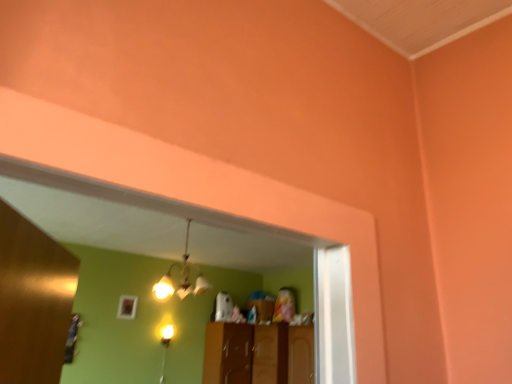
Describe the element at coordinates (228, 353) in the screenshot. Image resolution: width=512 pixels, height=384 pixels. I see `brown wood cabinet at center` at that location.

What is the approximate width of brown wood cabinet at center?

brown wood cabinet at center is 52.88 centimeters in width.

Locate an element on the screen. The height and width of the screenshot is (384, 512). brown wood cabinet at center is located at coordinates (228, 353).

What is the approximate width of matte brass chandelier at center?

matte brass chandelier at center is 19.59 inches wide.

In order to face matte brass chandelier at center, should I rotate leftwards or rightwards?

You should look left and rotate roughly 8.599 degrees.

Identify the location of matte brass chandelier at center. The image size is (512, 384). (181, 278).

Describe the element at coordinates (181, 278) in the screenshot. I see `matte brass chandelier at center` at that location.

Find the location of a particular element. brown wood cabinet at center is located at coordinates (228, 353).

Would you say brown wood cabinet at center is to the left or to the right of matte brass chandelier at center in the picture?

In the image, brown wood cabinet at center appears on the right side of matte brass chandelier at center.

In the image, is brown wood cabinet at center positioned in front of or behind matte brass chandelier at center?

Clearly, brown wood cabinet at center is behind matte brass chandelier at center.

Between point (244, 383) and point (198, 280), which one is positioned in front?

Positioned in front is point (198, 280).

From the image's perspective, who appears lower, brown wood cabinet at center or matte brass chandelier at center?

brown wood cabinet at center.

From a real-world perspective, relative to matte brass chandelier at center, is brown wood cabinet at center vertically above or below?

Clearly, from a real-world perspective, brown wood cabinet at center is below matte brass chandelier at center.

Considering the sizes of brown wood cabinet at center and matte brass chandelier at center in the image, is brown wood cabinet at center wider or thinner than matte brass chandelier at center?

Considering their sizes, brown wood cabinet at center looks broader than matte brass chandelier at center.

Can you confirm if brown wood cabinet at center is taller than matte brass chandelier at center?

Correct, brown wood cabinet at center is much taller as matte brass chandelier at center.

Does brown wood cabinet at center have a smaller size compared to matte brass chandelier at center?

Incorrect, brown wood cabinet at center is not smaller in size than matte brass chandelier at center.

Choose the correct answer: Is brown wood cabinet at center inside matte brass chandelier at center or outside it?

The correct answer is: outside.

Is brown wood cabinet at center far away from matte brass chandelier at center?

Indeed, brown wood cabinet at center is not near matte brass chandelier at center.

Is brown wood cabinet at center oriented away from matte brass chandelier at center?

No, matte brass chandelier at center is not at the back of brown wood cabinet at center.

Find the location of a particular element. light fixture above the brown wood cabinet at center (from a real-world perspective) is located at coordinates (181, 278).

Is matte brass chandelier at center to the left of brown wood cabinet at center from the viewer's perspective?

Yes, matte brass chandelier at center is to the left of brown wood cabinet at center.

Does matte brass chandelier at center come in front of brown wood cabinet at center?

Yes, it is.

Is point (161, 292) closer or farther from the camera than point (224, 355)?

Point (161, 292).

From the image's perspective, is matte brass chandelier at center under brown wood cabinet at center?

Actually, matte brass chandelier at center appears above brown wood cabinet at center in the image.

From a real-world perspective, is matte brass chandelier at center under brown wood cabinet at center?

Actually, matte brass chandelier at center is physically above brown wood cabinet at center in the real world.

Is matte brass chandelier at center wider than brown wood cabinet at center?

No, matte brass chandelier at center is not wider than brown wood cabinet at center.

From their relative heights in the image, would you say matte brass chandelier at center is taller or shorter than brown wood cabinet at center?

Considering their sizes, matte brass chandelier at center has less height than brown wood cabinet at center.

Is matte brass chandelier at center smaller than brown wood cabinet at center?

Correct, matte brass chandelier at center occupies less space than brown wood cabinet at center.

Would you say matte brass chandelier at center contains brown wood cabinet at center?

No, brown wood cabinet at center is not inside matte brass chandelier at center.

Can you see matte brass chandelier at center touching brown wood cabinet at center?

No, matte brass chandelier at center is not with brown wood cabinet at center.

Is matte brass chandelier at center aimed at brown wood cabinet at center?

No, matte brass chandelier at center is not facing towards brown wood cabinet at center.

How many degrees apart are the facing directions of matte brass chandelier at center and brown wood cabinet at center?

They differ by 2.41 degrees in their facing directions.

You are a GUI agent. You are given a task and a screenshot of the screen. Output one action in this format:
    pyautogui.click(x=<x>, y=<y>)
    Task: Click on the cabinetry on the right of matte brass chandelier at center
    This screenshot has height=384, width=512.
    Given the screenshot: What is the action you would take?
    pyautogui.click(x=228, y=353)

Locate an element on the screen. The image size is (512, 384). light fixture on the left of brown wood cabinet at center is located at coordinates (181, 278).

Locate an element on the screen. This screenshot has width=512, height=384. cabinetry on the right of matte brass chandelier at center is located at coordinates (228, 353).